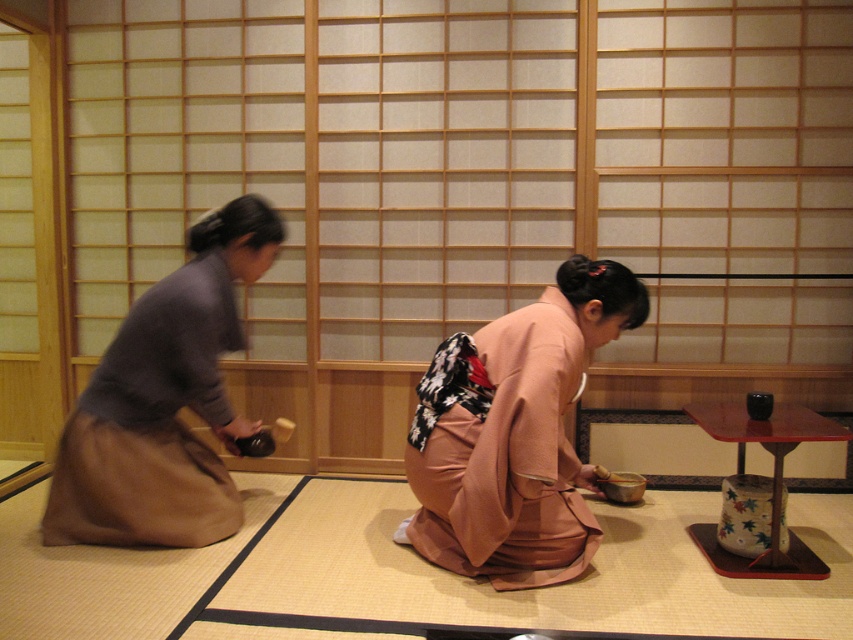
Describe the element at coordinates (514, 433) in the screenshot. The image size is (853, 640). I see `pink silk kimono at center` at that location.

Is point (421, 436) in front of point (71, 536)?

Yes, point (421, 436) is closer to viewer.

Where is `pink silk kimono at center`? The image size is (853, 640). pink silk kimono at center is located at coordinates (514, 433).